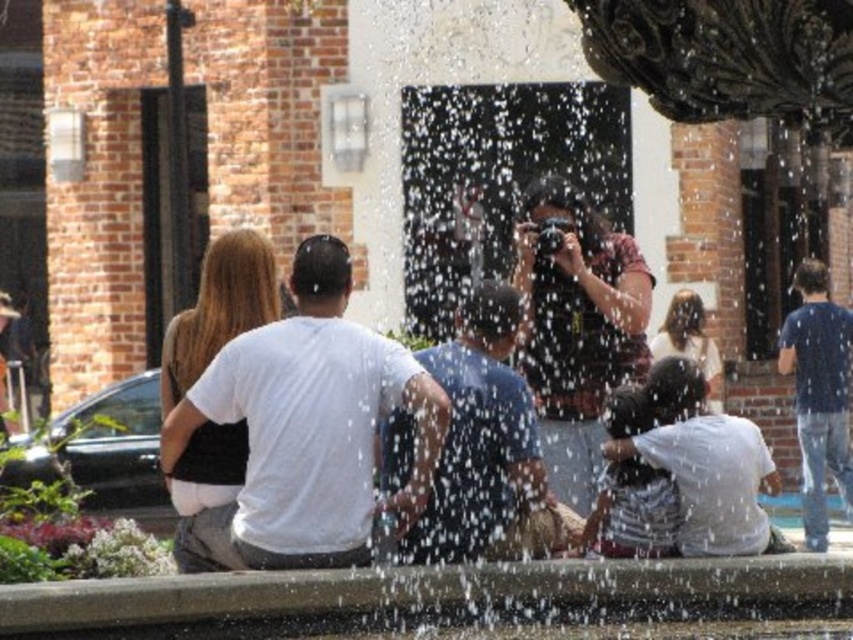
Is white matte t-shirt at center below matte black camera at center?

Yes, white matte t-shirt at center is below matte black camera at center.

Is point (311, 248) positioned after point (561, 426)?

No, it is not.

Where is `white matte t-shirt at center`? The image size is (853, 640). white matte t-shirt at center is located at coordinates (305, 429).

Is white cotton shirt at lower right positioned behind dark blue t-shirt at right?

No, white cotton shirt at lower right is in front of dark blue t-shirt at right.

Which is more to the left, white cotton shirt at lower right or dark blue t-shirt at right?

white cotton shirt at lower right

Does point (762, 531) come closer to viewer compared to point (851, 310)?

Yes, it is.

Where is `white cotton shirt at lower right`? white cotton shirt at lower right is located at coordinates (682, 472).

Who is lower down, matte black camera at center or blue cotton shirt at center?

blue cotton shirt at center is lower down.

Which is more to the right, matte black camera at center or blue cotton shirt at center?

matte black camera at center is more to the right.

The image size is (853, 640). What do you see at coordinates (576, 328) in the screenshot?
I see `matte black camera at center` at bounding box center [576, 328].

This screenshot has height=640, width=853. I want to click on matte black camera at center, so click(x=576, y=328).